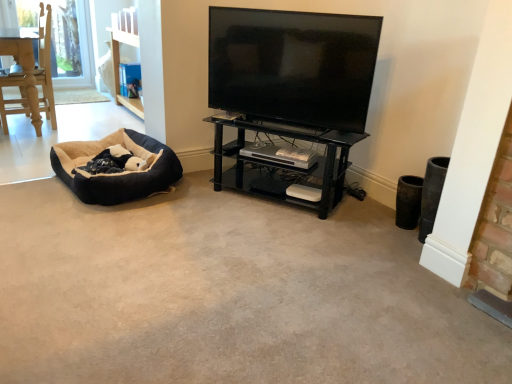
Question: Is black glass shelf at center at the right side of soft suede dog bed at left?

Choices:
 (A) no
 (B) yes

Answer: (B)

Question: Is black glass shelf at center positioned before soft suede dog bed at left?

Choices:
 (A) no
 (B) yes

Answer: (B)

Question: Is the position of black glass shelf at center more distant than that of soft suede dog bed at left?

Choices:
 (A) no
 (B) yes

Answer: (A)

Question: From a real-world perspective, is black glass shelf at center positioned under soft suede dog bed at left based on gravity?

Choices:
 (A) no
 (B) yes

Answer: (A)

Question: Is black glass shelf at center bigger than soft suede dog bed at left?

Choices:
 (A) no
 (B) yes

Answer: (B)

Question: Considering the relative sizes of black glass shelf at center and soft suede dog bed at left in the image provided, is black glass shelf at center shorter than soft suede dog bed at left?

Choices:
 (A) yes
 (B) no

Answer: (B)

Question: Is black glass shelf at center positioned in front of black glossy tv at upper center?

Choices:
 (A) yes
 (B) no

Answer: (B)

Question: Does black glass shelf at center have a lesser height compared to black glossy tv at upper center?

Choices:
 (A) yes
 (B) no

Answer: (A)

Question: Is black glass shelf at center positioned with its back to black glossy tv at upper center?

Choices:
 (A) no
 (B) yes

Answer: (A)

Question: Is black glass shelf at center directly adjacent to black glossy tv at upper center?

Choices:
 (A) yes
 (B) no

Answer: (B)

Question: Is there a large distance between black glass shelf at center and black glossy tv at upper center?

Choices:
 (A) no
 (B) yes

Answer: (A)

Question: Is black glass shelf at center wider than black glossy tv at upper center?

Choices:
 (A) yes
 (B) no

Answer: (A)

Question: Is black glossy tv at upper center thinner than black glass shelf at center?

Choices:
 (A) no
 (B) yes

Answer: (B)